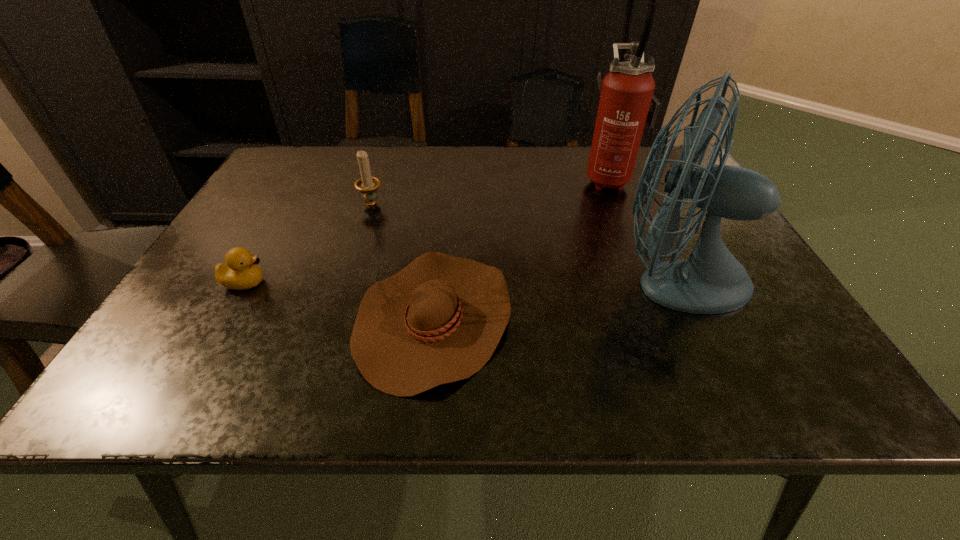
The height and width of the screenshot is (540, 960). I want to click on free location that satisfies the following two spatial constraints: 1. on the face of the third object from right to left; 2. on the right side of the second shortest object, so click(226, 317).

This screenshot has width=960, height=540. In order to click on free location that satisfies the following two spatial constraints: 1. on the back side of the shortest object; 2. on the face of the fourth tallest object in this screenshot , I will do `click(438, 282)`.

Where is `blank area in the image that satisfies the following two spatial constraints: 1. on the handle side of the fourth nearest object; 2. on the face of the second shortest object`? This screenshot has width=960, height=540. blank area in the image that satisfies the following two spatial constraints: 1. on the handle side of the fourth nearest object; 2. on the face of the second shortest object is located at coordinates (346, 282).

This screenshot has height=540, width=960. I want to click on free spot that satisfies the following two spatial constraints: 1. at the nozzle of the fire extinguisher; 2. on the front side of the cowboy hat, so click(666, 317).